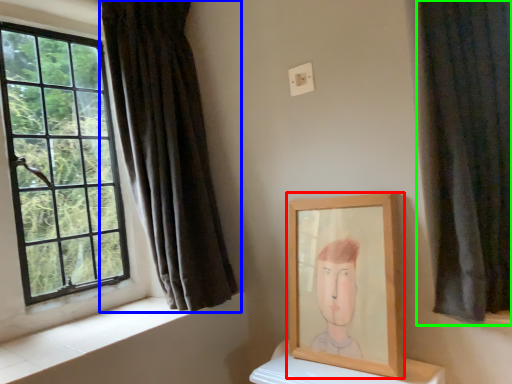
Question: Considering the real-world distances, which object is farthest from picture frame (highlighted by a red box)? curtain (highlighted by a blue box) or curtain (highlighted by a green box)?

Choices:
 (A) curtain
 (B) curtain

Answer: (A)